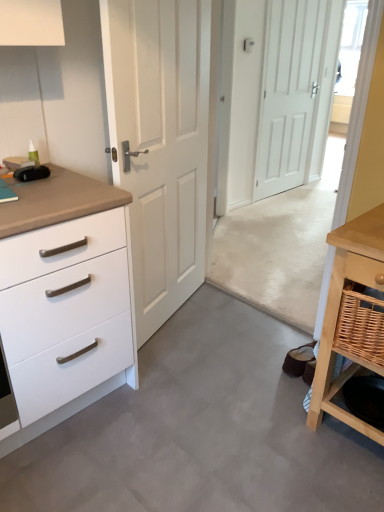
Identify the location of vacant region in front of white matte door at center, the first door in the back-to-front sequence. (290, 202).